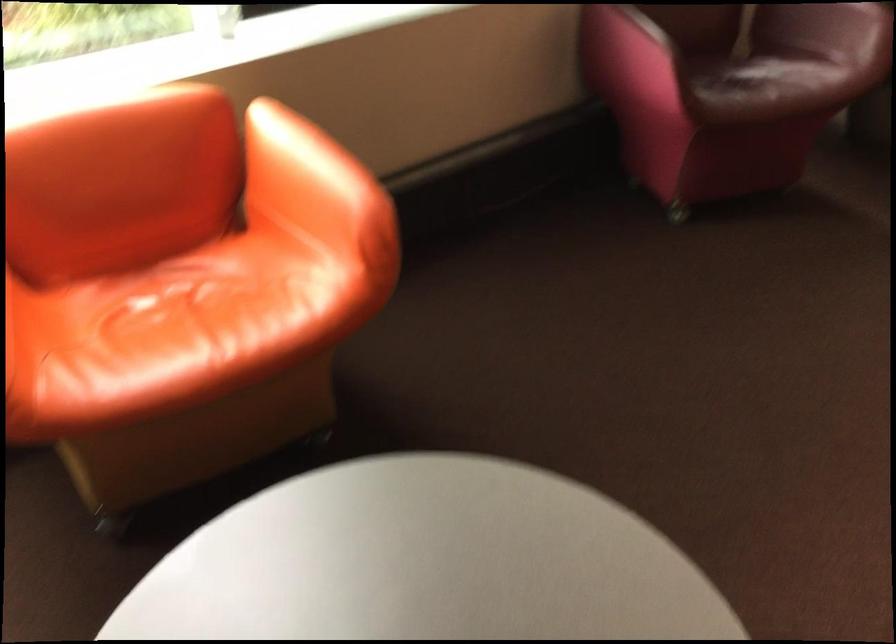
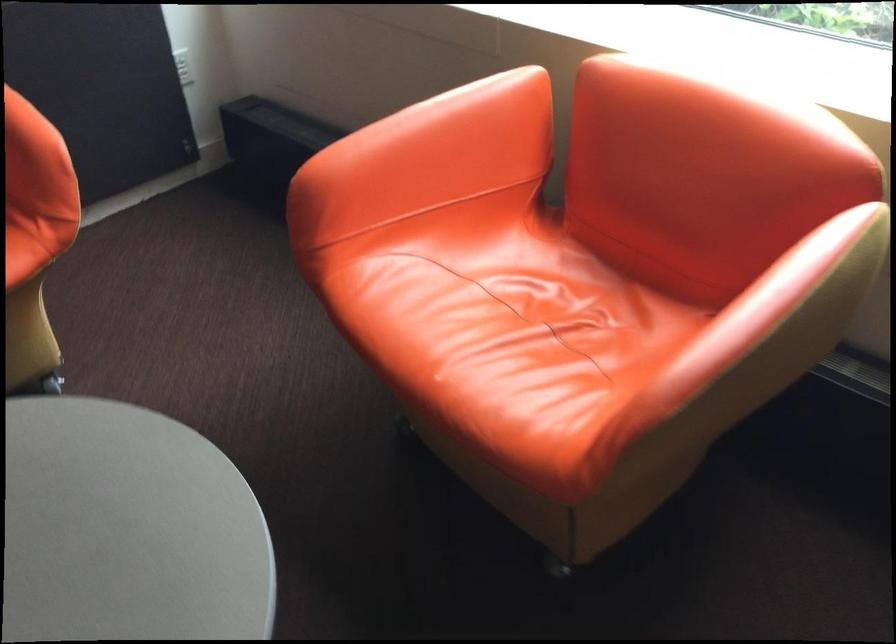
Locate, in the second image, the point that corresponds to point 334,152 in the first image.

(794, 323)